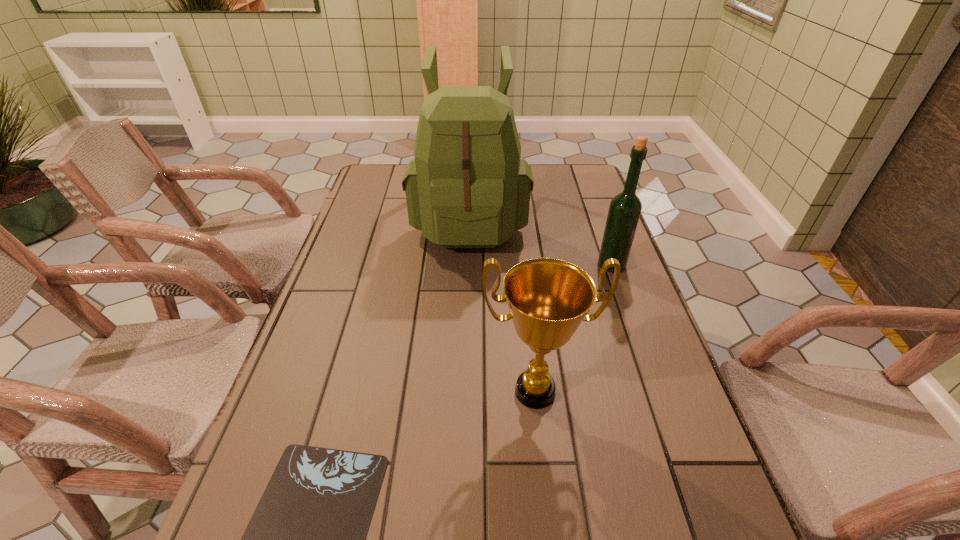
Where is `vacant space at the right edge of the desktop`? The width and height of the screenshot is (960, 540). vacant space at the right edge of the desktop is located at coordinates (641, 298).

Where is `blank space at the far left corner of the desktop`? This screenshot has height=540, width=960. blank space at the far left corner of the desktop is located at coordinates (400, 171).

In the image, there is a desktop. At what (x,y) coordinates should I click in order to perform the action: click on vacant area at the far right corner. Please return your answer as a coordinate pair (x, y). The height and width of the screenshot is (540, 960). Looking at the image, I should click on (576, 174).

This screenshot has height=540, width=960. In order to click on empty location between the liquor and the tallest object in this screenshot , I will do `click(540, 241)`.

Image resolution: width=960 pixels, height=540 pixels. Find the location of `vacant region between the tallest object and the award`. vacant region between the tallest object and the award is located at coordinates (502, 305).

Image resolution: width=960 pixels, height=540 pixels. What are the coordinates of `free space between the award and the tallest object` in the screenshot? It's located at (502, 305).

This screenshot has width=960, height=540. What are the coordinates of `vacant space in between the tallest object and the rightmost object` in the screenshot? It's located at (540, 241).

Choose which object is the second nearest neighbor to the backpack. Please provide its 2D coordinates. Your answer should be formatted as a tuple, i.e. [(x, y)], where the tuple contains the x and y coordinates of a point satisfying the conditions above.

[(548, 299)]

This screenshot has height=540, width=960. I want to click on object that ranks as the third closest to the backpack, so click(306, 538).

Image resolution: width=960 pixels, height=540 pixels. I want to click on vacant region that satisfies the following two spatial constraints: 1. on the front pocket of the rightmost object; 2. on the left side of the backpack, so click(468, 265).